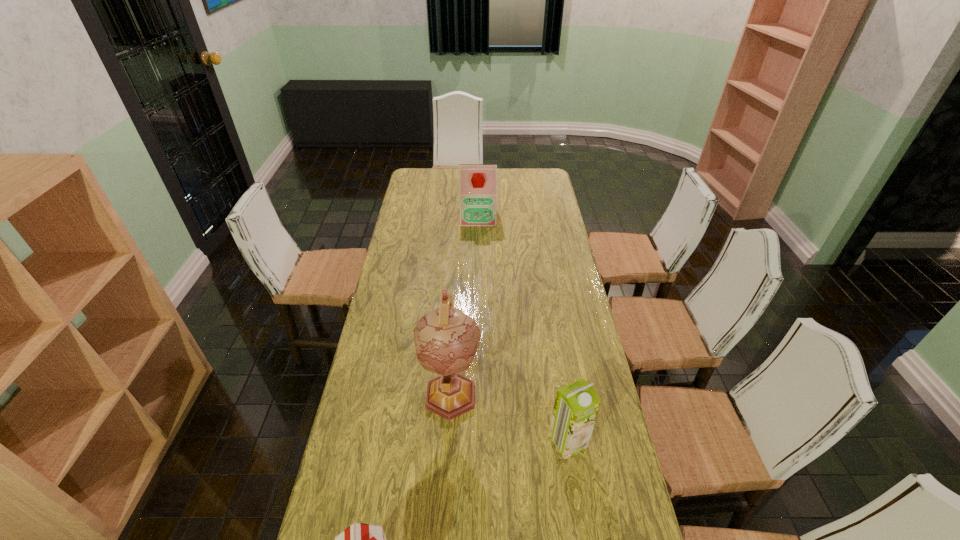
Locate an element on the screen. Image resolution: width=960 pixels, height=540 pixels. globe is located at coordinates (446, 339).

You are a GUI agent. You are given a task and a screenshot of the screen. Output one action in this format:
    pyautogui.click(x=<x>, y=<y>)
    Task: Click on the farthest soya milk
    The width and height of the screenshot is (960, 540).
    Given the screenshot: What is the action you would take?
    pyautogui.click(x=477, y=182)

The height and width of the screenshot is (540, 960). I want to click on the farthest object, so pos(477,182).

The height and width of the screenshot is (540, 960). Identify the location of the rightmost object. (x=576, y=406).

In order to click on the second nearest soya milk in this screenshot , I will do `click(576, 406)`.

What are the coordinates of `free spot located 0.290m on the front-facing side of the tallest object` in the screenshot? It's located at [443, 539].

Identify the location of free spot located 0.150m with the cap open on the farthest soya milk. (478, 246).

The image size is (960, 540). I want to click on vacant region located 0.390m on the left of the rightmost soya milk, so click(411, 441).

Find the location of a particular element. The image size is (960, 540). object that is at the right edge is located at coordinates (576, 406).

Locate an element on the screen. The image size is (960, 540). blank space at the far edge of the desktop is located at coordinates (452, 185).